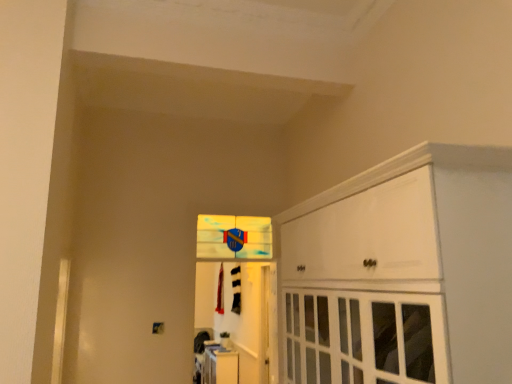
Question: Does white glossy door at center have a greater height compared to white glossy cabinet at lower center, which ranks as the second cabinetry in right-to-left order?

Choices:
 (A) no
 (B) yes

Answer: (B)

Question: Considering the relative sizes of white glossy door at center and white glossy cabinet at lower center, which is counted as the 2th cabinetry, starting from the top, in the image provided, is white glossy door at center wider than white glossy cabinet at lower center, which is counted as the 2th cabinetry, starting from the top,?

Choices:
 (A) no
 (B) yes

Answer: (A)

Question: Is white glossy door at center at the left side of white glossy cabinet at lower center, which is counted as the 2th cabinetry, starting from the top?

Choices:
 (A) no
 (B) yes

Answer: (A)

Question: Is white glossy door at center not close to white glossy cabinet at lower center, the first cabinetry from the left?

Choices:
 (A) yes
 (B) no

Answer: (B)

Question: Considering the relative sizes of white glossy door at center and white glossy cabinet at lower center, which appears as the first cabinetry when ordered from the bottom, in the image provided, is white glossy door at center shorter than white glossy cabinet at lower center, which appears as the first cabinetry when ordered from the bottom,?

Choices:
 (A) yes
 (B) no

Answer: (B)

Question: Would you say white glossy cabinet at upper right, which is the 1th cabinetry in right-to-left order, is to the left or to the right of translucent glass window at center in the picture?

Choices:
 (A) right
 (B) left

Answer: (A)

Question: Considering the positions of white glossy cabinet at upper right, which is counted as the second cabinetry, starting from the back, and translucent glass window at center in the image, is white glossy cabinet at upper right, which is counted as the second cabinetry, starting from the back, wider or thinner than translucent glass window at center?

Choices:
 (A) thin
 (B) wide

Answer: (B)

Question: Is point (398, 286) closer or farther from the camera than point (229, 253)?

Choices:
 (A) farther
 (B) closer

Answer: (B)

Question: Would you say white glossy cabinet at upper right, which is the 1th cabinetry in right-to-left order, is inside or outside translucent glass window at center?

Choices:
 (A) inside
 (B) outside

Answer: (B)

Question: In the image, is white glossy door at center positioned in front of or behind white glossy cabinet at upper right, which appears as the 1th cabinetry when viewed from the top?

Choices:
 (A) behind
 (B) front

Answer: (A)

Question: Considering the positions of white glossy door at center and white glossy cabinet at upper right, which is the second cabinetry from left to right, in the image, is white glossy door at center taller or shorter than white glossy cabinet at upper right, which is the second cabinetry from left to right,?

Choices:
 (A) short
 (B) tall

Answer: (B)

Question: Is point (202, 218) closer or farther from the camera than point (366, 331)?

Choices:
 (A) farther
 (B) closer

Answer: (A)

Question: In terms of size, does white glossy door at center appear bigger or smaller than white glossy cabinet at upper right, which appears as the 1th cabinetry when viewed from the top?

Choices:
 (A) big
 (B) small

Answer: (B)

Question: Is white glossy door at center spatially inside white glossy cabinet at lower center, positioned as the first cabinetry in back-to-front order, or outside of it?

Choices:
 (A) outside
 (B) inside

Answer: (A)

Question: In the image, is white glossy door at center positioned in front of or behind white glossy cabinet at lower center, which appears as the first cabinetry when ordered from the bottom?

Choices:
 (A) behind
 (B) front

Answer: (B)